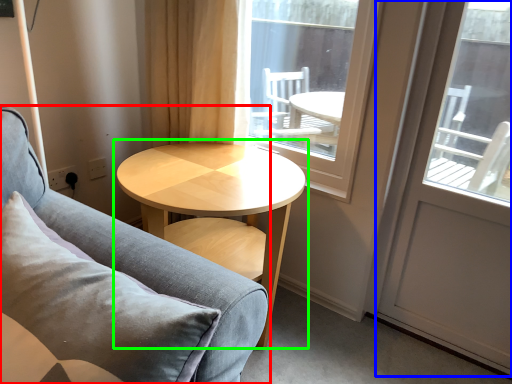
Question: Based on their relative distances, which object is nearer to studio couch (highlighted by a red box)? Choose from screen door (highlighted by a blue box) and coffee table (highlighted by a green box).

Choices:
 (A) screen door
 (B) coffee table

Answer: (B)